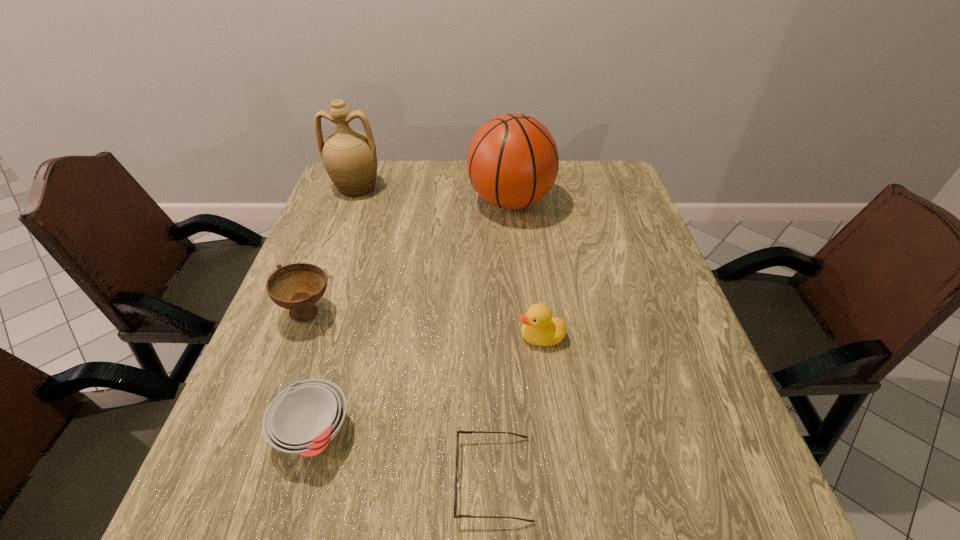
This screenshot has height=540, width=960. Identify the location of vacant area located on the face of the fourth tallest object. (485, 337).

This screenshot has height=540, width=960. Find the location of `free location located 0.250m on the face of the fourth tallest object`. free location located 0.250m on the face of the fourth tallest object is located at coordinates [x=400, y=337].

This screenshot has width=960, height=540. What are the coordinates of `vacant space located 0.310m on the face of the fourth tallest object` in the screenshot? It's located at (372, 337).

The height and width of the screenshot is (540, 960). In order to click on vacant space located on the right of the fifth tallest object in this screenshot , I will do `click(510, 432)`.

The image size is (960, 540). I want to click on free region located 0.190m on the front-facing side of the shortest object, so click(x=340, y=478).

This screenshot has height=540, width=960. What are the coordinates of `vacant area situated on the front-facing side of the shortest object` in the screenshot? It's located at (274, 478).

This screenshot has height=540, width=960. What are the coordinates of `free space located on the front-facing side of the shortest object` in the screenshot? It's located at (340, 478).

At what (x,y) coordinates should I click in order to perform the action: click on pitcher situated at the far edge. Please return your answer as a coordinate pair (x, y). The width and height of the screenshot is (960, 540). Looking at the image, I should click on (349, 156).

You are a GUI agent. You are given a task and a screenshot of the screen. Output one action in this format:
    pyautogui.click(x=<x>, y=<y>)
    Task: Click on the basketball present at the far edge
    
    Given the screenshot: What is the action you would take?
    pyautogui.click(x=512, y=162)

You are a GUI agent. You are given a task and a screenshot of the screen. Output one action in this format:
    pyautogui.click(x=<x>, y=<y>)
    Task: Click on the object located at the near edge
    The image size is (960, 540).
    Given the screenshot: What is the action you would take?
    pyautogui.click(x=457, y=480)